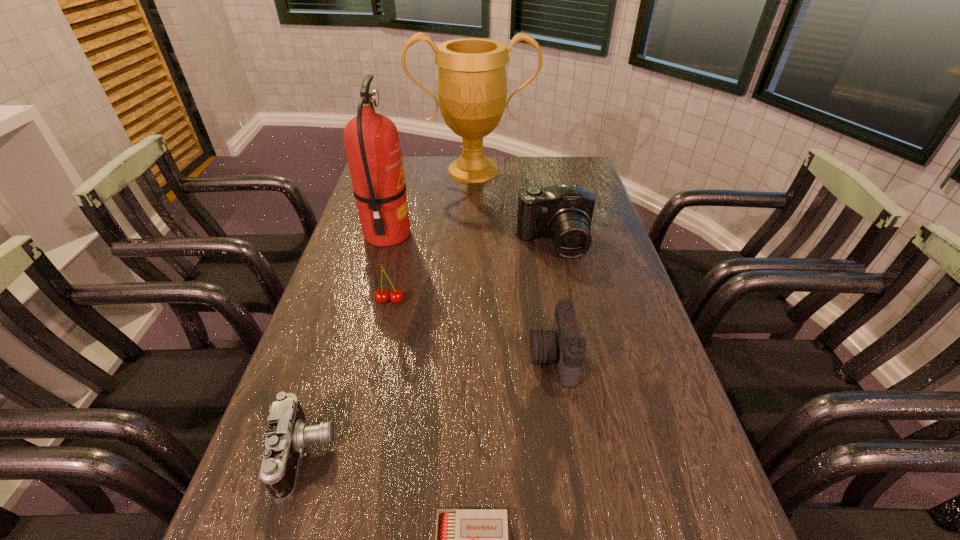
I want to click on free space that satisfies the following two spatial constraints: 1. on the engravings side of the trophy; 2. on the side of the fire extinguisher with the nozzle and handle, so click(x=471, y=235).

The height and width of the screenshot is (540, 960). Find the location of `free space in the image that satisfies the following two spatial constraints: 1. on the engravings side of the farthest object; 2. at the lens of the leftmost camera`. free space in the image that satisfies the following two spatial constraints: 1. on the engravings side of the farthest object; 2. at the lens of the leftmost camera is located at coordinates pos(466,454).

I want to click on vacant space that satisfies the following two spatial constraints: 1. on the lens of the tallest camera; 2. at the lens of the sixth farthest object, so click(599, 454).